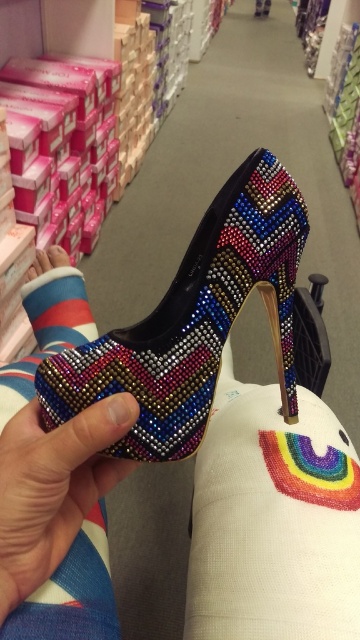
Based on the photo, you are a customer trying to decide between the multicolored beaded shoe at center and the striped cotton sock at lower left. Which item is wider?

The multicolored beaded shoe at center is wider than the striped cotton sock at lower left according to the description provided.

You are a customer in a shoe store and you see the multicolored beaded shoe at center and the striped cotton sock at lower left. Which item is nearer to you?

The multicolored beaded shoe at center is closer to the viewer than the striped cotton sock at lower left.

From the picture: You are a photographer trying to capture the multicolored beaded shoe at center. The camera you are using has a minimum focusing distance of 12 inches. Can you take a clear photo of the shoe without moving either the camera or the shoe?

The multicolored beaded shoe at center and camera are 13.45 inches apart, which is beyond the camera minimum focusing distance of 12 inches. Therefore, you can take a clear photo of the multicolored beaded shoe at center without moving either the camera or the shoe.